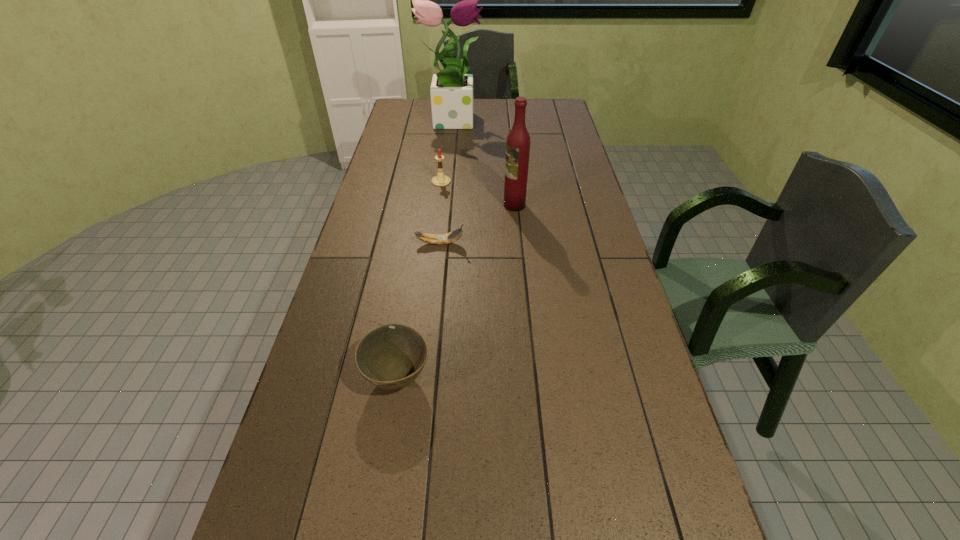
Find the location of a particular element. object at the far left corner is located at coordinates (451, 91).

Identify the location of vacant region at the left edge of the desktop. (385, 205).

Locate an element on the screen. The width and height of the screenshot is (960, 540). vacant space at the right edge is located at coordinates (595, 289).

You are a GUI agent. You are given a task and a screenshot of the screen. Output one action in this format:
    pyautogui.click(x=<x>, y=<y>)
    Task: Click on the vacant space at the far right corner
    This screenshot has height=540, width=960.
    Given the screenshot: What is the action you would take?
    pyautogui.click(x=541, y=111)

You are a GUI agent. You are given a task and a screenshot of the screen. Output one action in this format:
    pyautogui.click(x=<x>, y=<y>)
    Task: Click on the empty location between the candle and the flower arrangement
    The width and height of the screenshot is (960, 540).
    Given the screenshot: What is the action you would take?
    pyautogui.click(x=446, y=150)

The width and height of the screenshot is (960, 540). I want to click on free space between the bowl and the shortest object, so click(419, 310).

The width and height of the screenshot is (960, 540). I want to click on free spot between the flower arrangement and the liquor, so click(483, 162).

I want to click on vacant region between the farthest object and the fourth nearest object, so click(446, 150).

Where is `vacant area between the third shortest object and the fourth tallest object`? vacant area between the third shortest object and the fourth tallest object is located at coordinates (420, 280).

I want to click on vacant space that is in between the banana and the candle, so click(441, 212).